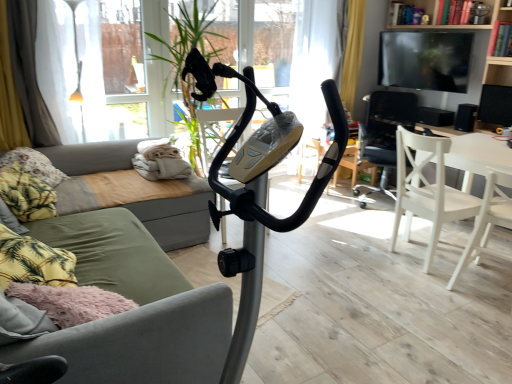
What do you see at coordinates (132, 191) in the screenshot? I see `green fabric couch at left` at bounding box center [132, 191].

Measure the distance between point (511, 101) and camera.

Point (511, 101) is 3.69 meters from camera.

The image size is (512, 384). What do you see at coordinates (487, 220) in the screenshot?
I see `white wood chair at right, acting as the first chair starting from the front` at bounding box center [487, 220].

What do you see at coordinates (426, 189) in the screenshot?
I see `white wood chair at lower right, placed as the second chair when sorted from front to back` at bounding box center [426, 189].

The width and height of the screenshot is (512, 384). Describe the element at coordinates (425, 60) in the screenshot. I see `black glossy tv at upper right` at that location.

Locate an element on the screen. The height and width of the screenshot is (384, 512). black glossy tv at upper right is located at coordinates (425, 60).

Locate an element on the screen. The width and height of the screenshot is (512, 384). green fabric couch at left is located at coordinates (132, 191).

Identify the location of the 1st chair positioned below the white wood chair at center right, marked as the third chair in a front-to-back arrangement (from the image's perspective). (426, 189).

Can you confirm if white wood chair at lower right, placed as the second chair when sorted from front to back, is shorter than white wood chair at center right, which is the first chair in back-to-front order?

Indeed, white wood chair at lower right, placed as the second chair when sorted from front to back, has a lesser height compared to white wood chair at center right, which is the first chair in back-to-front order.

From a real-world perspective, between white wood chair at lower right, placed as the second chair when sorted from front to back, and white wood chair at center right, marked as the third chair in a front-to-back arrangement, who is vertically lower?

white wood chair at lower right, placed as the second chair when sorted from front to back.

Based on the photo, is white wood chair at lower right, placed as the second chair when sorted from front to back, far from white wood chair at center right, marked as the third chair in a front-to-back arrangement?

That's not correct — white wood chair at lower right, placed as the second chair when sorted from front to back, is a little close to white wood chair at center right, marked as the third chair in a front-to-back arrangement.

Between green fabric couch at center and fluffy fabric pillow at left, which appears as the first pillow when viewed from the front, which one has smaller width?

With smaller width is fluffy fabric pillow at left, which appears as the first pillow when viewed from the front.

Does green fabric couch at center come behind fluffy fabric pillow at left, which appears as the first pillow when viewed from the front?

No.

Considering the positions of points (177, 281) and (3, 169), is point (177, 281) farther from camera compared to point (3, 169)?

That is False.

Would you say green fabric couch at center is inside or outside fluffy fabric pillow at left, placed as the second pillow when sorted from back to front?

green fabric couch at center is spatially situated outside fluffy fabric pillow at left, placed as the second pillow when sorted from back to front.

Considering the sizes of black matte speaker at right, the second speaker in the front-to-back sequence, and fluffy fabric pillow at left, placed as the second pillow when sorted from back to front, in the image, is black matte speaker at right, the second speaker in the front-to-back sequence, wider or thinner than fluffy fabric pillow at left, placed as the second pillow when sorted from back to front,?

Clearly, black matte speaker at right, the second speaker in the front-to-back sequence, has less width compared to fluffy fabric pillow at left, placed as the second pillow when sorted from back to front.

From the image's perspective, is black matte speaker at right, the second speaker in the front-to-back sequence, located above or below fluffy fabric pillow at left, placed as the second pillow when sorted from back to front?

From the image's perspective, black matte speaker at right, the second speaker in the front-to-back sequence, appears above fluffy fabric pillow at left, placed as the second pillow when sorted from back to front.

Considering the sizes of black matte speaker at right, the second speaker in the front-to-back sequence, and fluffy fabric pillow at left, which appears as the first pillow when viewed from the front, in the image, is black matte speaker at right, the second speaker in the front-to-back sequence, taller or shorter than fluffy fabric pillow at left, which appears as the first pillow when viewed from the front,?

Considering their sizes, black matte speaker at right, the second speaker in the front-to-back sequence, has less height than fluffy fabric pillow at left, which appears as the first pillow when viewed from the front.

From a real-world perspective, between black matte speaker at right, the second speaker in the front-to-back sequence, and fluffy fabric pillow at left, placed as the second pillow when sorted from back to front, who is vertically lower?

fluffy fabric pillow at left, placed as the second pillow when sorted from back to front.

Consider the image. From a real-world perspective, which is physically below, black matte speaker at upper right, the first speaker positioned from the front, or green fabric couch at left?

green fabric couch at left, from a real-world perspective.

Who is shorter, black matte speaker at upper right, the first speaker positioned from the front, or green fabric couch at left?

Standing shorter between the two is black matte speaker at upper right, the first speaker positioned from the front.

Between black matte speaker at upper right, which ranks as the 3th speaker in back-to-front order, and green fabric couch at left, which one appears on the left side from the viewer's perspective?

From the viewer's perspective, green fabric couch at left appears more on the left side.

Based on the photo, can we say black matte speaker at upper right, the first speaker positioned from the front, lies outside green fabric couch at left?

black matte speaker at upper right, the first speaker positioned from the front, is positioned outside green fabric couch at left.

Which object is more forward, green leafy plant at center or fluffy fabric pillow at left, which is the 2th pillow from front to back?

fluffy fabric pillow at left, which is the 2th pillow from front to back, is in front.

Can you confirm if green leafy plant at center is smaller than fluffy fabric pillow at left, arranged as the 1th pillow when viewed from the back?

No, green leafy plant at center is not smaller than fluffy fabric pillow at left, arranged as the 1th pillow when viewed from the back.

Consider the image. From a real-world perspective, does green leafy plant at center sit lower than fluffy fabric pillow at left, which is the 2th pillow from front to back?

Incorrect, from a real-world perspective, green leafy plant at center is higher than fluffy fabric pillow at left, which is the 2th pillow from front to back.

From the image's perspective, which one is positioned lower, green leafy plant at center or fluffy fabric pillow at left, arranged as the 1th pillow when viewed from the back?

fluffy fabric pillow at left, arranged as the 1th pillow when viewed from the back, is shown below in the image.

Is point (228, 107) farther from viewer compared to point (443, 114)?

That is False.

From the picture: From a real-world perspective, is green leafy plant at center positioned above or below black matte speaker at center, which is the 1th speaker in back-to-front order?

green leafy plant at center is situated higher than black matte speaker at center, which is the 1th speaker in back-to-front order, in the real world.

Between green leafy plant at center and black matte speaker at center, which is the 1th speaker in back-to-front order, which one has less height?

Standing shorter between the two is black matte speaker at center, which is the 1th speaker in back-to-front order.

Between green leafy plant at center and black matte speaker at center, which is the 1th speaker in back-to-front order, which one appears on the right side from the viewer's perspective?

black matte speaker at center, which is the 1th speaker in back-to-front order.

From the image's perspective, is black matte speaker at right, the second speaker in the front-to-back sequence, on green fabric couch at left?

Correct, black matte speaker at right, the second speaker in the front-to-back sequence, appears higher than green fabric couch at left in the image.

Is black matte speaker at right, which is the 2th speaker in back-to-front order, wider or thinner than green fabric couch at left?

black matte speaker at right, which is the 2th speaker in back-to-front order, is thinner than green fabric couch at left.

Are black matte speaker at right, the second speaker in the front-to-back sequence, and green fabric couch at left located far from each other?

That's right, there is a large distance between black matte speaker at right, the second speaker in the front-to-back sequence, and green fabric couch at left.

Does point (457, 123) lie behind point (114, 168)?

Yes, it is behind point (114, 168).

Where is `the 1st chair to the right of the white wood chair at lower right, placed as the second chair when sorted from front to back, counting from the anchor's position`? This screenshot has width=512, height=384. the 1st chair to the right of the white wood chair at lower right, placed as the second chair when sorted from front to back, counting from the anchor's position is located at coordinates (384, 135).

Where is `the 1st pillow positioned above the green fabric couch at center (from a real-world perspective)`? the 1st pillow positioned above the green fabric couch at center (from a real-world perspective) is located at coordinates (26, 194).

Estimate the real-world distances between objects in this image. Which object is closer to white wood chair at right, acting as the 3th chair starting from the back, black matte speaker at center, which is the 1th speaker in back-to-front order, or green fabric couch at left?

black matte speaker at center, which is the 1th speaker in back-to-front order, lies closer to white wood chair at right, acting as the 3th chair starting from the back, than the other object.

Considering their positions, is yellow fabric curtain at left positioned closer to black matte speaker at right, which is the 2th speaker in back-to-front order, than wooden bookshelf at upper right?

Based on the image, wooden bookshelf at upper right appears to be nearer to black matte speaker at right, which is the 2th speaker in back-to-front order.

Based on their spatial positions, is yellow fabric curtain at left or white wood chair at center right, which is the first chair in back-to-front order, further from fluffy fabric pillow at left, which is the 2th pillow from front to back?

white wood chair at center right, which is the first chair in back-to-front order, lies further to fluffy fabric pillow at left, which is the 2th pillow from front to back, than the other object.

Based on the photo, which object lies nearer to the anchor point white wood chair at lower right, placed as the second chair when sorted from front to back, black matte speaker at center, positioned as the 3th speaker in front-to-back order, or yellow fabric curtain at left?

Based on the image, black matte speaker at center, positioned as the 3th speaker in front-to-back order, appears to be nearer to white wood chair at lower right, placed as the second chair when sorted from front to back.

Estimate the real-world distances between objects in this image. Which object is closer to fluffy fabric pillow at left, placed as the second pillow when sorted from back to front, green fabric couch at center or white wood chair at lower right, placed as the second chair when sorted from front to back?

green fabric couch at center is positioned closer to the anchor fluffy fabric pillow at left, placed as the second pillow when sorted from back to front.

Considering their positions, is yellow fabric curtain at left positioned closer to wooden bookshelf at upper right than white wood chair at right, acting as the 3th chair starting from the back?

The object closer to wooden bookshelf at upper right is white wood chair at right, acting as the 3th chair starting from the back.

From the image, which object appears to be nearer to black glossy tv at upper right, green fabric couch at center or white wood chair at lower right, positioned as the 2th chair in back-to-front order?

white wood chair at lower right, positioned as the 2th chair in back-to-front order, is closer to black glossy tv at upper right.

When comparing their distances from white wood chair at right, acting as the first chair starting from the front, does black glossy tv at upper right or white wood chair at lower right, placed as the second chair when sorted from front to back, seem closer?

white wood chair at lower right, placed as the second chair when sorted from front to back, is closer to white wood chair at right, acting as the first chair starting from the front.

The height and width of the screenshot is (384, 512). Find the location of `studio couch between fluffy fabric pillow at left, placed as the second pillow when sorted from back to front, and white wood chair at right, acting as the 3th chair starting from the back, in the horizontal direction`. studio couch between fluffy fabric pillow at left, placed as the second pillow when sorted from back to front, and white wood chair at right, acting as the 3th chair starting from the back, in the horizontal direction is located at coordinates (132, 191).

This screenshot has height=384, width=512. Identify the location of plant between green fabric couch at center and wooden bookshelf at upper right. (184, 63).

You are a GUI agent. You are given a task and a screenshot of the screen. Output one action in this format:
    pyautogui.click(x=<x>, y=<y>)
    Task: Click on the plant between green fabric couch at left and white wood chair at right, acting as the first chair starting from the front, in the horizontal direction
    
    Given the screenshot: What is the action you would take?
    pyautogui.click(x=184, y=63)

The width and height of the screenshot is (512, 384). What are the coordinates of `plant between green fabric couch at left and white wood chair at lower right, placed as the second chair when sorted from front to back, from left to right` in the screenshot? It's located at (184, 63).